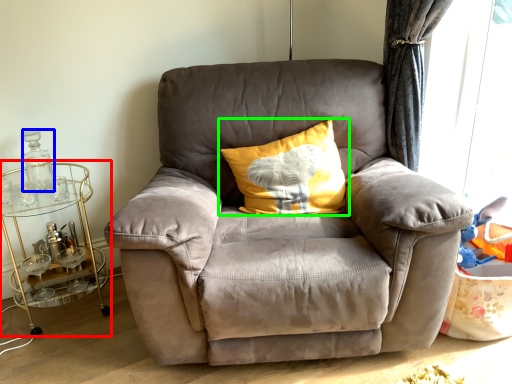
Question: Which is farther away from table (highlighted by a red box)? bottle (highlighted by a blue box) or pillow (highlighted by a green box)?

Choices:
 (A) bottle
 (B) pillow

Answer: (B)